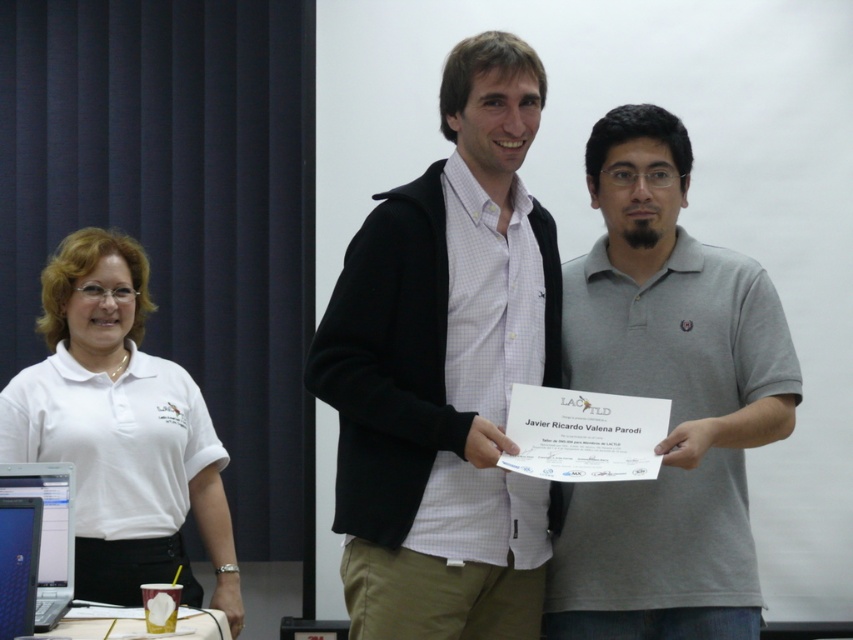
You are a photographer at the event and need to ensure both the gray cotton polo shirt at center and the white cotton shirt at left are clearly visible in the photo. Which of the two should you focus on first to ensure depth of field captures both?

You should focus on the gray cotton polo shirt at center first since it is closer to the camera than the white cotton shirt at left. By focusing on the closer object, the depth of field will extend backward, potentially keeping both in focus.

You are a photographer at the event and need to capture a photo of both the gray cotton polo shirt at center and the white cotton shirt at left. The camera has a maximum focus range of 40 inches. Will you be able to include both shirts in the same frame without moving the camera?

The gray cotton polo shirt at center is 38.75 inches away from the white cotton shirt at left. Since the distance between them is within the camera maximum focus range of 40 inches, you can include both shirts in the same frame without moving the camera.

You are organizing the event and need to place a new decorative item on the desk. The desk has limited space. Which laptop should you move to accommodate the item, the blue glossy laptop at lower left or the matte black laptop at left?

You should move the matte black laptop at left because the blue glossy laptop at lower left is positioned above it, meaning the matte black laptop is lower and likely closer to the edge where you can place the new item without disturbing the upper laptop.